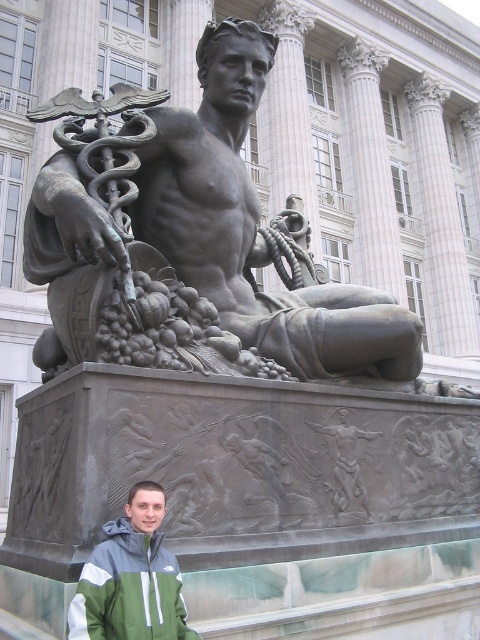
Who is more forward, (321,332) or (101,560)?

Positioned in front is point (101,560).

Can you confirm if bronze statue at center is wider than green fabric jacket at lower left?

Yes, bronze statue at center is wider than green fabric jacket at lower left.

Who is more forward, (204, 108) or (178, 592)?

Point (178, 592) is more forward.

Where is `bronze statue at center`? This screenshot has height=640, width=480. bronze statue at center is located at coordinates (252, 227).